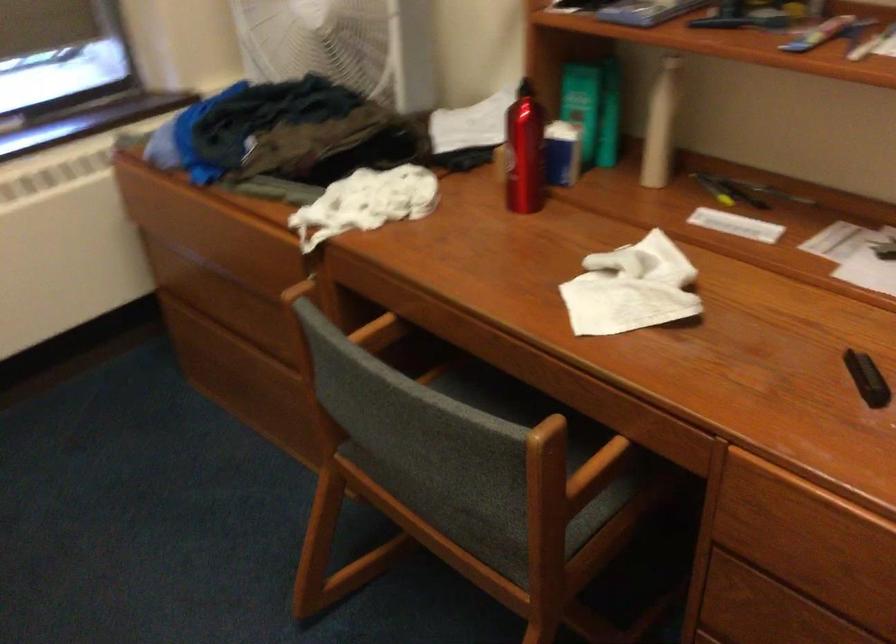
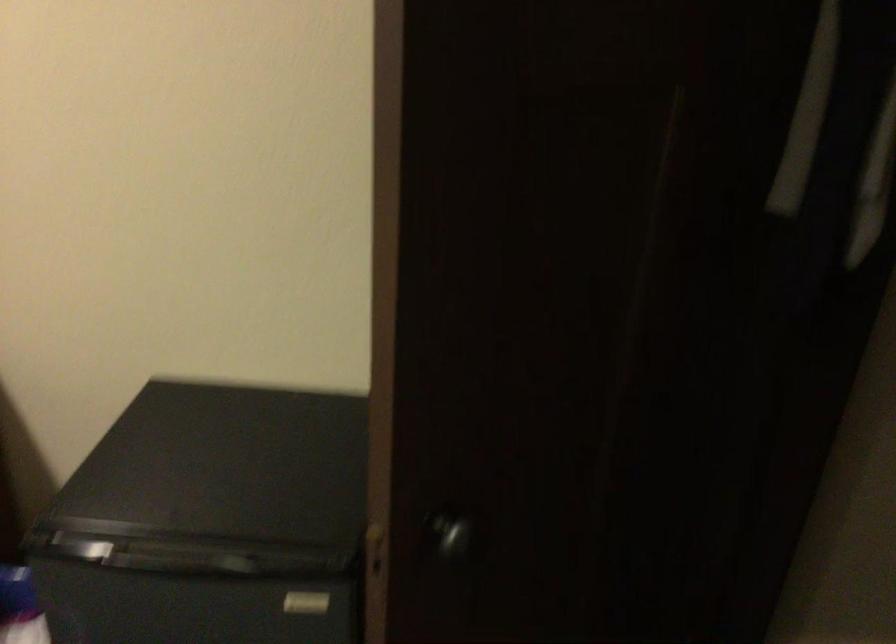
Question: How did the camera likely rotate?

Choices:
 (A) Left
 (B) Right
 (C) Up
 (D) Down

Answer: (B)